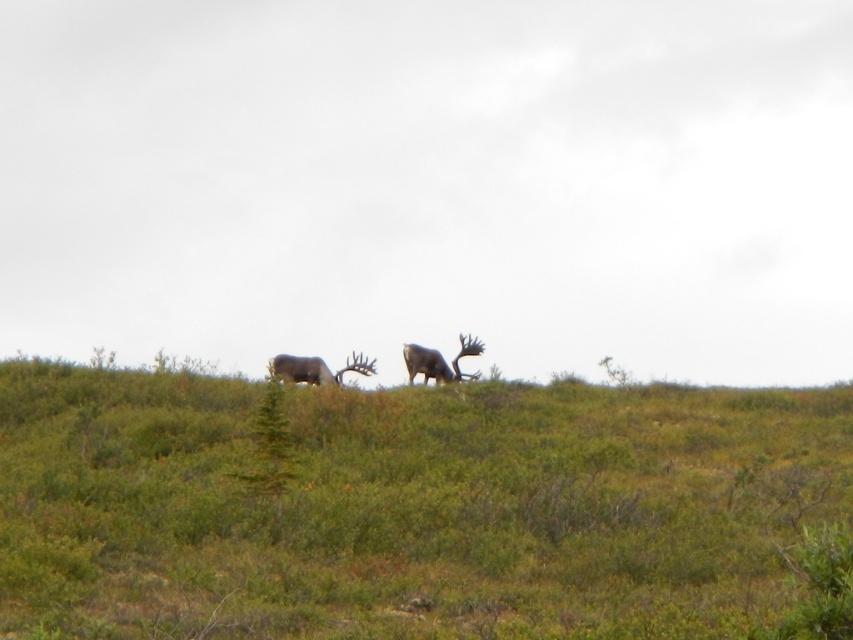
Question: Based on their relative distances, which object is nearer to the shiny brown antlered deer at center?

Choices:
 (A) green grassy hillside at center
 (B) brown velvet antlered deer at center

Answer: (B)

Question: Is brown velvet antlered deer at center thinner than shiny brown antlered deer at center?

Choices:
 (A) no
 (B) yes

Answer: (B)

Question: Which object appears farthest from the camera in this image?

Choices:
 (A) shiny brown antlered deer at center
 (B) green grassy hillside at center

Answer: (A)

Question: Is brown velvet antlered deer at center below shiny brown antlered deer at center?

Choices:
 (A) yes
 (B) no

Answer: (A)

Question: Estimate the real-world distances between objects in this image. Which object is closer to the brown velvet antlered deer at center?

Choices:
 (A) shiny brown antlered deer at center
 (B) green grassy hillside at center

Answer: (A)

Question: Can you confirm if green grassy hillside at center is wider than shiny brown antlered deer at center?

Choices:
 (A) no
 (B) yes

Answer: (B)